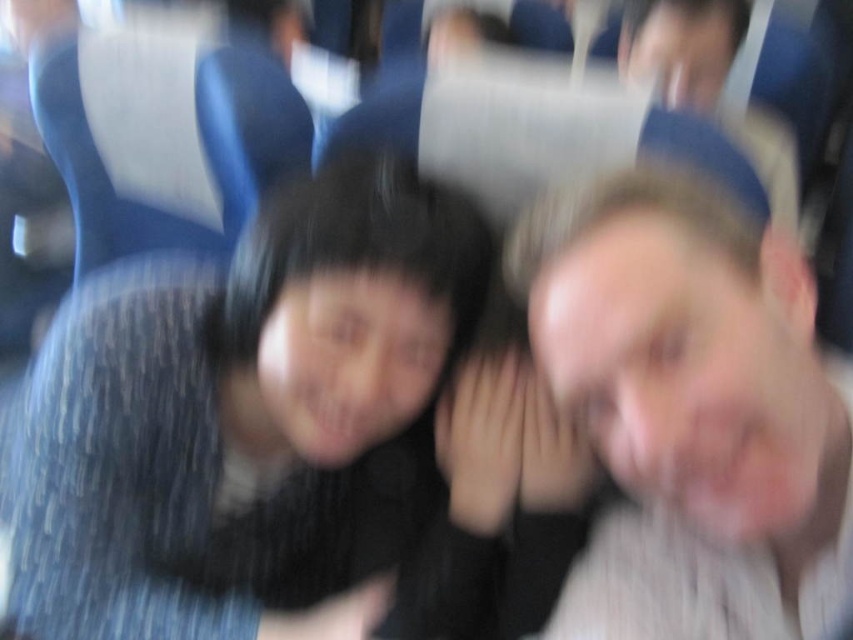
Question: Is matte black hair at center above smooth skin face at right?

Choices:
 (A) yes
 (B) no

Answer: (B)

Question: Can you confirm if matte black hair at center is positioned above smooth skin face at right?

Choices:
 (A) yes
 (B) no

Answer: (B)

Question: Is matte black hair at center above smooth skin face at right?

Choices:
 (A) no
 (B) yes

Answer: (A)